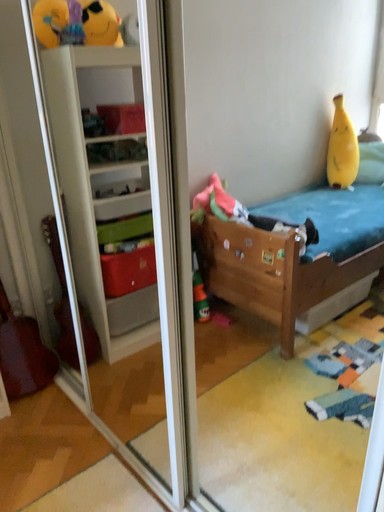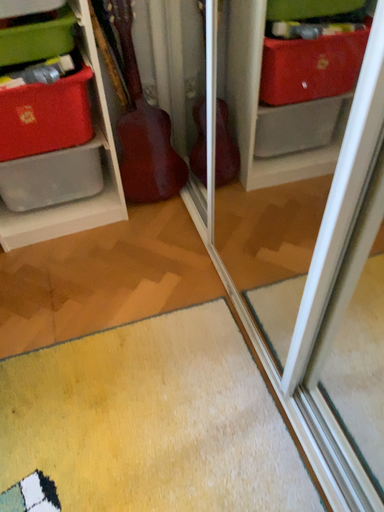
Question: Which way did the camera rotate in the video?

Choices:
 (A) rotated upward
 (B) rotated downward

Answer: (B)